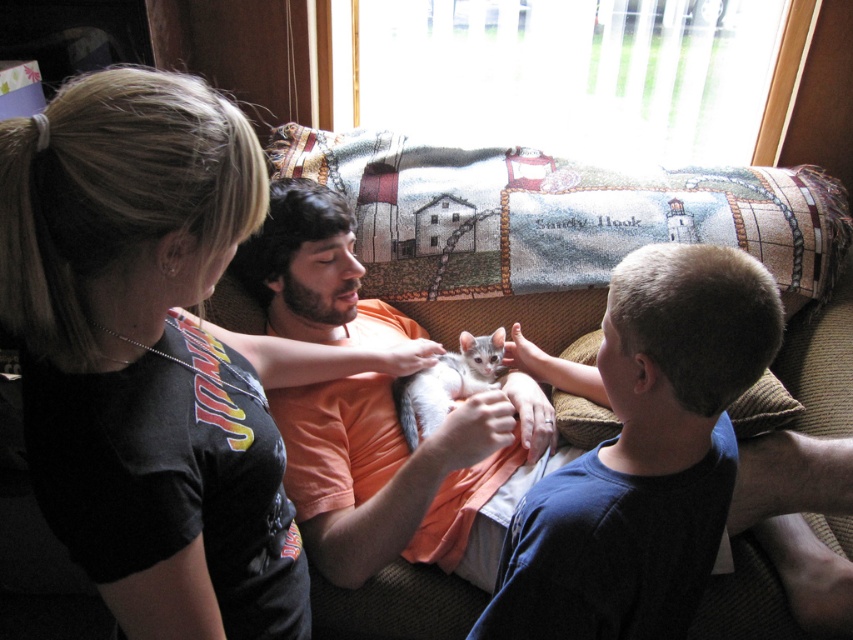
Question: Considering the real-world distances, which object is farthest from the orange cotton shirt at center?

Choices:
 (A) textured fabric couch at center
 (B) smooth blue shirt at center
 (C) gray fur cat at center

Answer: (B)

Question: Can you confirm if orange cotton shirt at center is positioned to the right of gray fur cat at center?

Choices:
 (A) no
 (B) yes

Answer: (A)

Question: Which of the following is the farthest from the observer?

Choices:
 (A) (492, 353)
 (B) (387, 515)

Answer: (A)

Question: Which of these objects is positioned closest to the textured fabric couch at center?

Choices:
 (A) smooth blue shirt at center
 (B) gray fur cat at center
 (C) orange cotton shirt at center

Answer: (C)

Question: In this image, where is smooth blue shirt at center located relative to gray fur cat at center?

Choices:
 (A) below
 (B) above

Answer: (A)

Question: Does orange cotton shirt at center appear under gray fur cat at center?

Choices:
 (A) no
 (B) yes

Answer: (A)